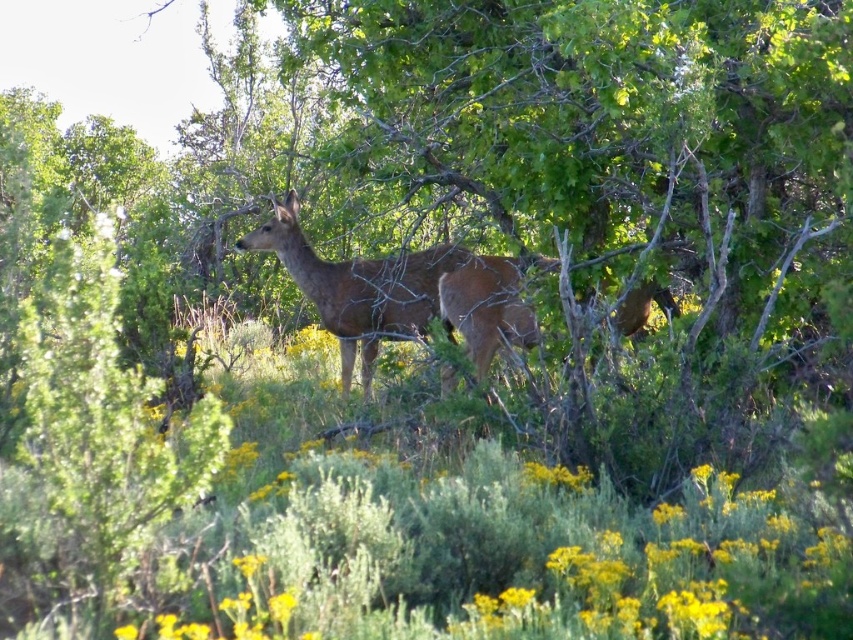
Is green leafy tree at center thinner than brown matte/deer at center?

Incorrect, green leafy tree at center's width is not less than brown matte/deer at center's.

Measure the distance between green leafy tree at center and camera.

green leafy tree at center and camera are 4.56 meters apart from each other.

Is point (648, 172) more distant than point (425, 275)?

That is False.

Identify the location of green leafy tree at center. This screenshot has height=640, width=853. (624, 138).